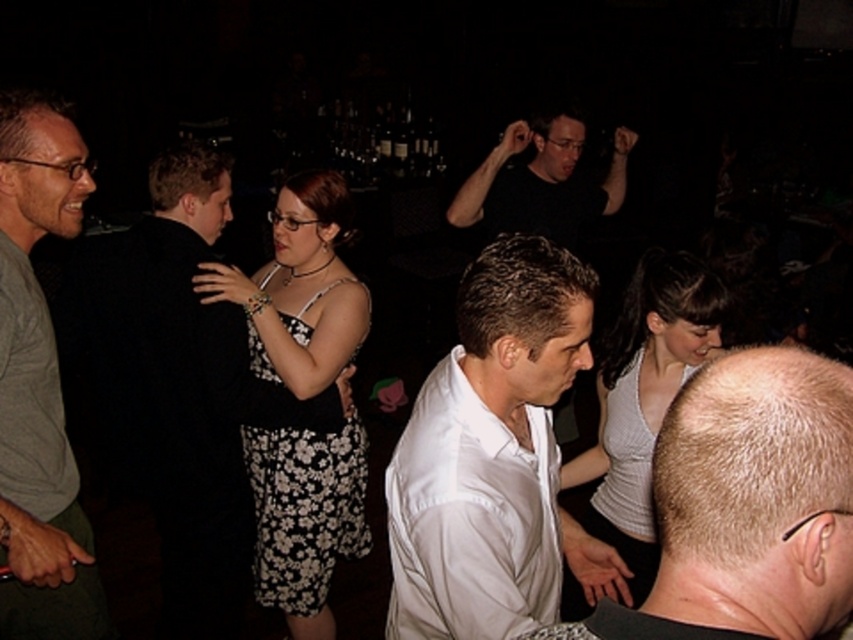
You are at a party and see two people wearing the white ribbed tank top at center and the black floral dress at center. Which clothing item is bigger?

The white ribbed tank top at center is larger in size than the black floral dress at center.

You are at a party and notice two people in the crowd. One is wearing a black fabric shirt at left and the other a white smooth shirt at center. Which person is positioned lower in the image?

The black fabric shirt at left is located below the white smooth shirt at center, so the person wearing the black fabric shirt at left is positioned lower in the image.